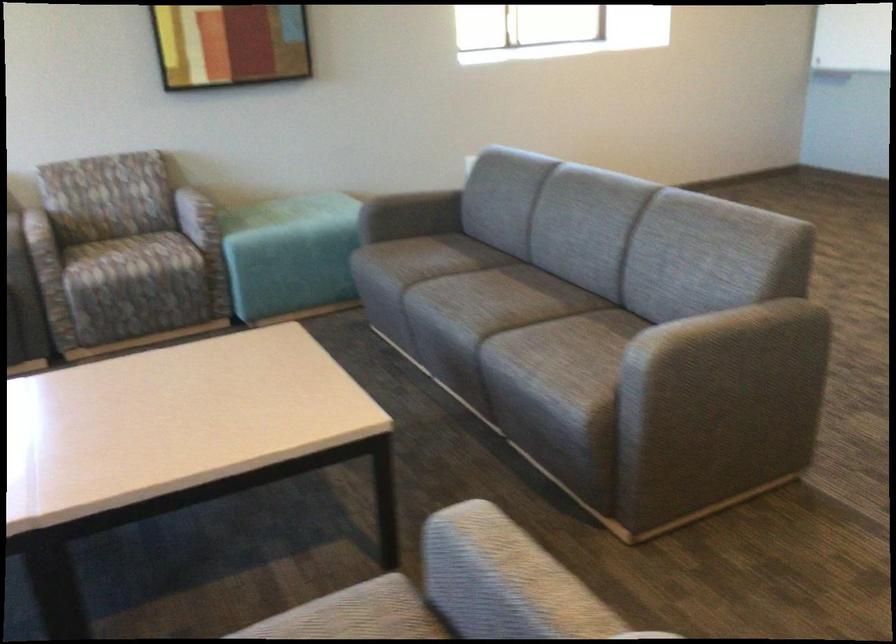
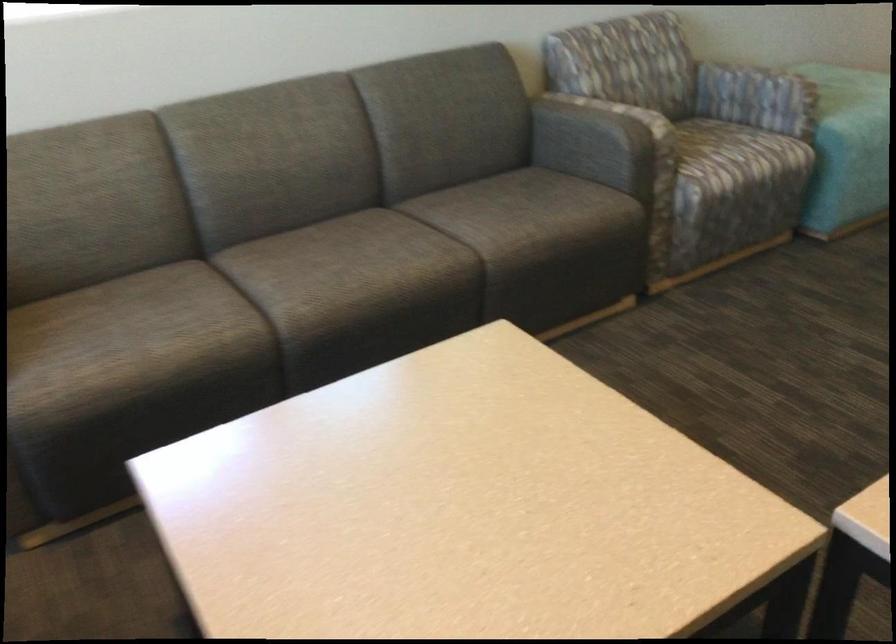
Where in the second image is the point corresponding to (x=192, y=212) from the first image?

(728, 84)